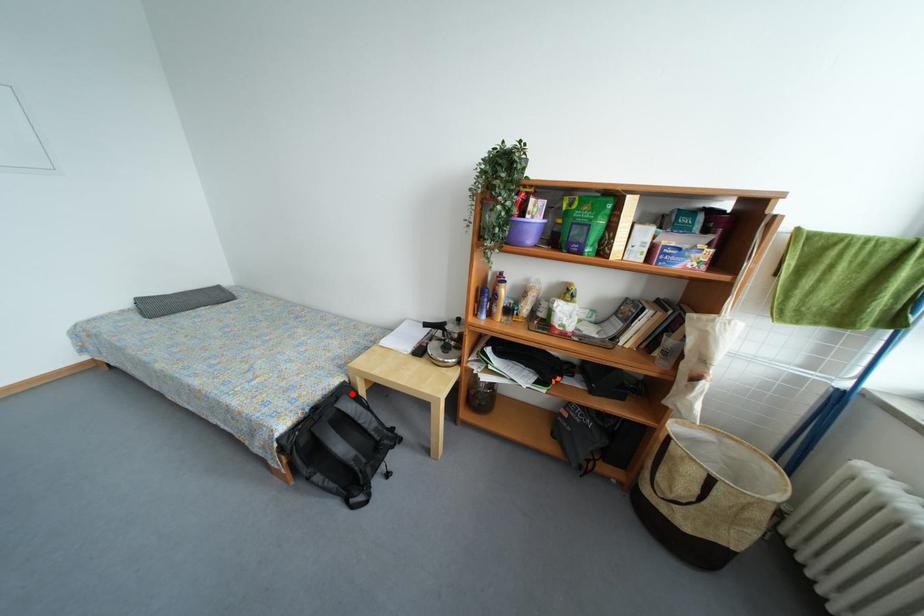
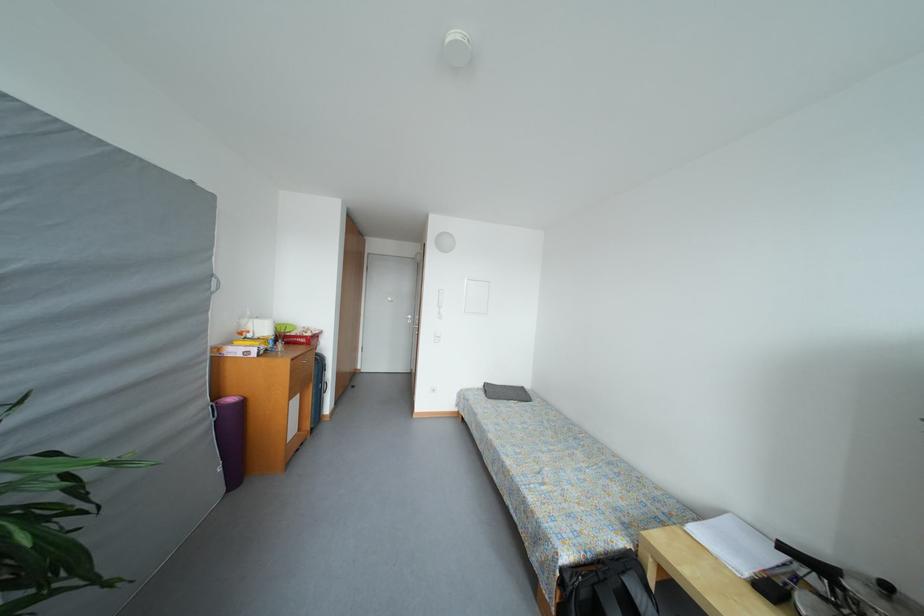
Question: I am providing you with two images of the same scene from different viewpoints. In image1, a red point is highlighted. Considering the same 3D point in image2, which of the following is correct?

Choices:
 (A) It is closer
 (B) It is farther

Answer: (A)